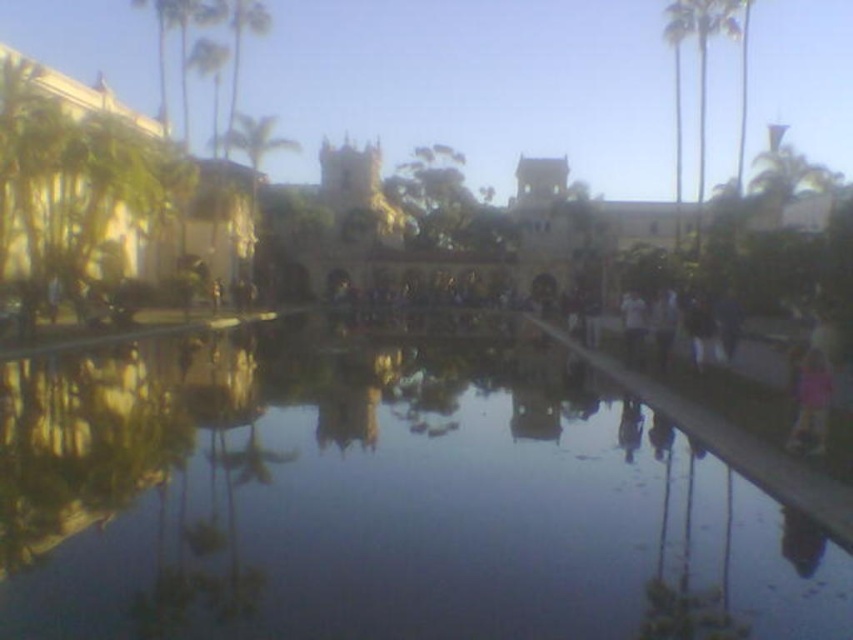
Question: Which object is the farthest from the transparent liquid water at center?

Choices:
 (A) green leafy palm tree at upper right
 (B) green leafy palm tree at right

Answer: (B)

Question: Is green leafy palm tree at upper right to the right of green leafy palm tree at right from the viewer's perspective?

Choices:
 (A) no
 (B) yes

Answer: (A)

Question: Does transparent liquid water at center have a greater width compared to green leafy palm tree at upper right?

Choices:
 (A) no
 (B) yes

Answer: (B)

Question: Which is nearer to the green leafy palm tree at right?

Choices:
 (A) green leafy palm tree at upper right
 (B) transparent liquid water at center

Answer: (B)

Question: Is the position of transparent liquid water at center less distant than that of green leafy palm tree at right?

Choices:
 (A) yes
 (B) no

Answer: (A)

Question: Based on their relative distances, which object is nearer to the transparent liquid water at center?

Choices:
 (A) green leafy palm tree at right
 (B) green leafy palm tree at upper right

Answer: (B)